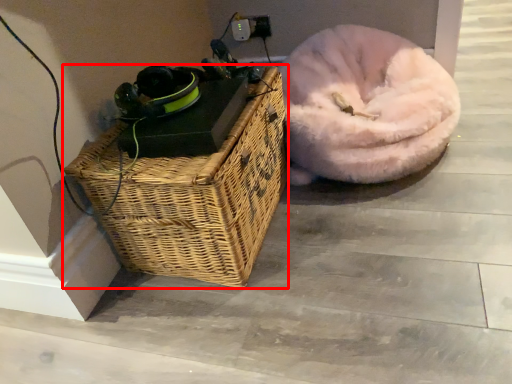
Question: From the image's perspective, where is picnic basket (annotated by the red box) located relative to dog bed?

Choices:
 (A) below
 (B) above

Answer: (A)